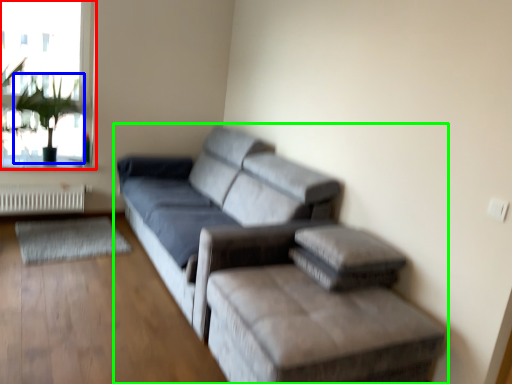
Question: Based on their relative distances, which object is nearer to window (highlighted by a red box)? Choose from plant (highlighted by a blue box) and studio couch (highlighted by a green box).

Choices:
 (A) plant
 (B) studio couch

Answer: (A)